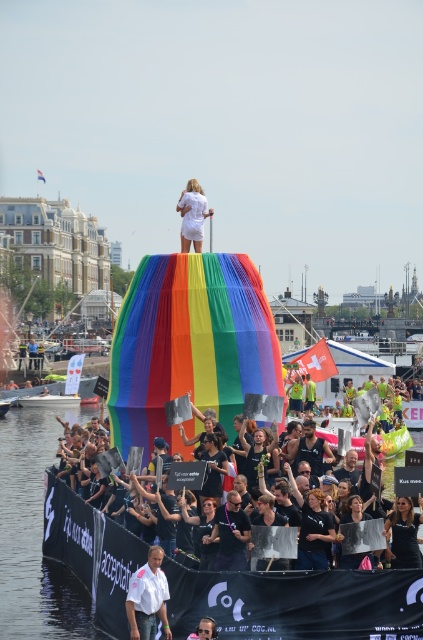
Is point (194, 193) less distant than point (313, 458)?

No, it is behind (313, 458).

Who is more forward, (192, 204) or (312, 440)?

Positioned in front is point (312, 440).

Locate an element on the screen. This screenshot has width=423, height=640. white matte dress at upper center is located at coordinates (192, 216).

You are a GUI agent. You are given a task and a screenshot of the screen. Output one action in this format:
    pyautogui.click(x=<x>, y=<y>)
    Task: Click on the white matte dress at upper center
    
    Given the screenshot: What is the action you would take?
    pyautogui.click(x=192, y=216)

Is white matte dress at upper center shorter than white plastic boat at center?

Incorrect, white matte dress at upper center's height does not fall short of white plastic boat at center's.

Between point (186, 204) and point (47, 396), which one is positioned behind?

Positioned behind is point (47, 396).

Where is `white matte dress at upper center`? white matte dress at upper center is located at coordinates (192, 216).

Is white matte shirt at lower center taller than white matte dress at upper center?

In fact, white matte shirt at lower center may be shorter than white matte dress at upper center.

Can you confirm if white matte shirt at lower center is bigger than white matte dress at upper center?

Incorrect, white matte shirt at lower center is not larger than white matte dress at upper center.

This screenshot has height=640, width=423. What are the coordinates of `white matte shirt at lower center` in the screenshot? It's located at (148, 596).